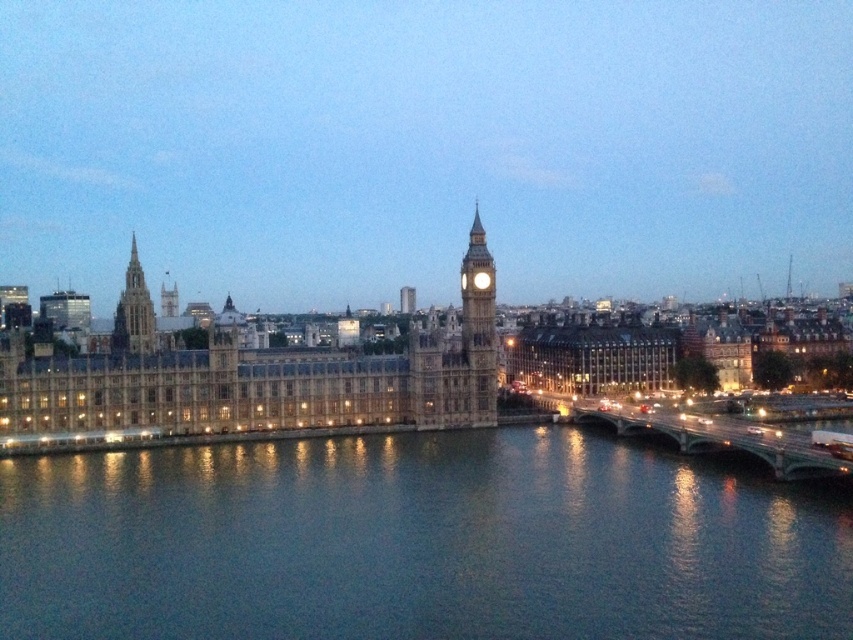
Question: Which point is farther from the camera taking this photo?

Choices:
 (A) (86, 397)
 (B) (480, 280)

Answer: (B)

Question: Is golden stone big ben at center thinner than concrete bridge at lower right?

Choices:
 (A) no
 (B) yes

Answer: (A)

Question: Does stone clock tower at center appear on the right side of white stone clock at center?

Choices:
 (A) yes
 (B) no

Answer: (A)

Question: Estimate the real-world distances between objects in this image. Which object is closer to the golden stone big ben at center?

Choices:
 (A) golden stone palace at center
 (B) white stone clock at center

Answer: (A)

Question: Can you confirm if stone clock tower at center is positioned to the left of golden stone spire at upper left?

Choices:
 (A) no
 (B) yes

Answer: (A)

Question: Which of the following is the farthest from the observer?

Choices:
 (A) concrete bridge at lower right
 (B) stone clock tower at center
 (C) golden stone palace at center
 (D) golden stone spire at upper left

Answer: (D)